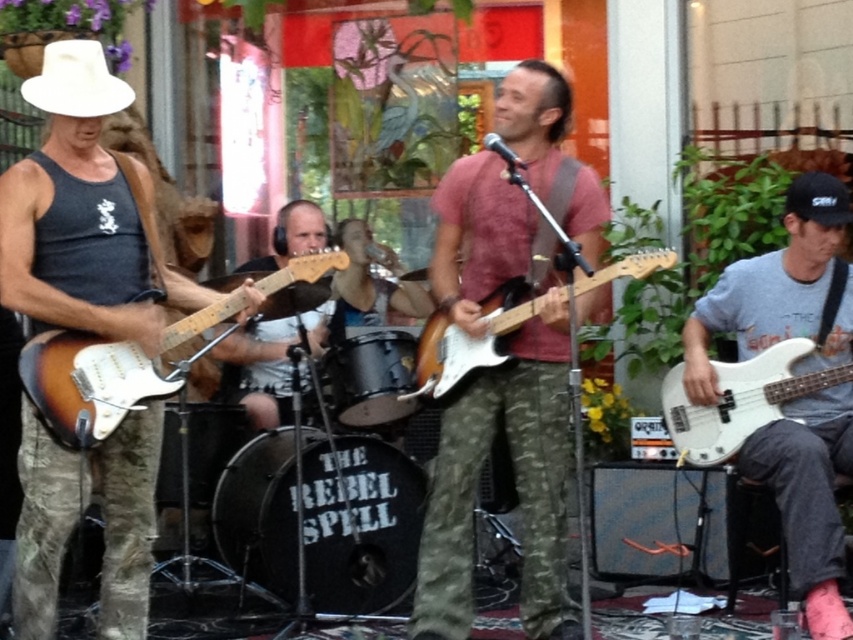
Which of these two, matte white electric guitar at center or white felt cowboy hat at upper left, stands taller?

With more height is matte white electric guitar at center.

The height and width of the screenshot is (640, 853). What do you see at coordinates (469, 339) in the screenshot? I see `matte white electric guitar at center` at bounding box center [469, 339].

Locate an element on the screen. Image resolution: width=853 pixels, height=640 pixels. matte white electric guitar at center is located at coordinates (469, 339).

Between point (352, 419) and point (68, 51), which one is positioned behind?

The point (352, 419) is behind.

Is black drum at center bigger than white felt cowboy hat at upper left?

Yes.

Identify the location of black drum at center. (372, 378).

Find the location of `black drum at center`. black drum at center is located at coordinates (372, 378).

Between black drumhead at center and black drum at center, which one appears on the left side from the viewer's perspective?

black drumhead at center is more to the left.

Does point (316, 516) come behind point (335, 378)?

No, it is not.

What do you see at coordinates (358, 522) in the screenshot?
I see `black drumhead at center` at bounding box center [358, 522].

Where is `black drumhead at center`? The height and width of the screenshot is (640, 853). black drumhead at center is located at coordinates (358, 522).